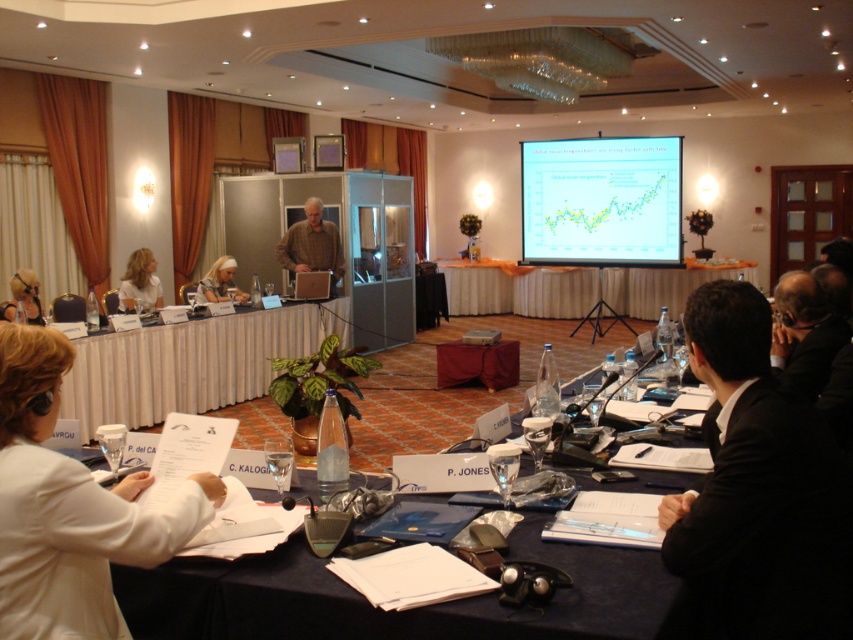
You are sitting at the dark blue tablecloth in the formal meeting. You notice the plaid wool sweater at center and the blonde hair at upper left. Which object is positioned to the right of the other?

The plaid wool sweater at center is to the right of blonde hair at upper left.

You are organizing a presentation and need to decide which device to use for displaying data. Considering the available devices in the room, which one is bigger between the matte white projection screen at upper center and the matte black laptop at left?

The matte white projection screen at upper center is larger in size than the matte black laptop at left, so it is the better choice for displaying data during the presentation.

You are an attendee at this meeting and want to get a better view of the projection screen. Which person should you move past to have a clearer view, the blonde hair at upper left or the white hair at center?

The blonde hair at upper left is taller than the white hair at center, so moving past the blonde hair at upper left would provide a clearer view of the projection screen since it is the taller obstruction.